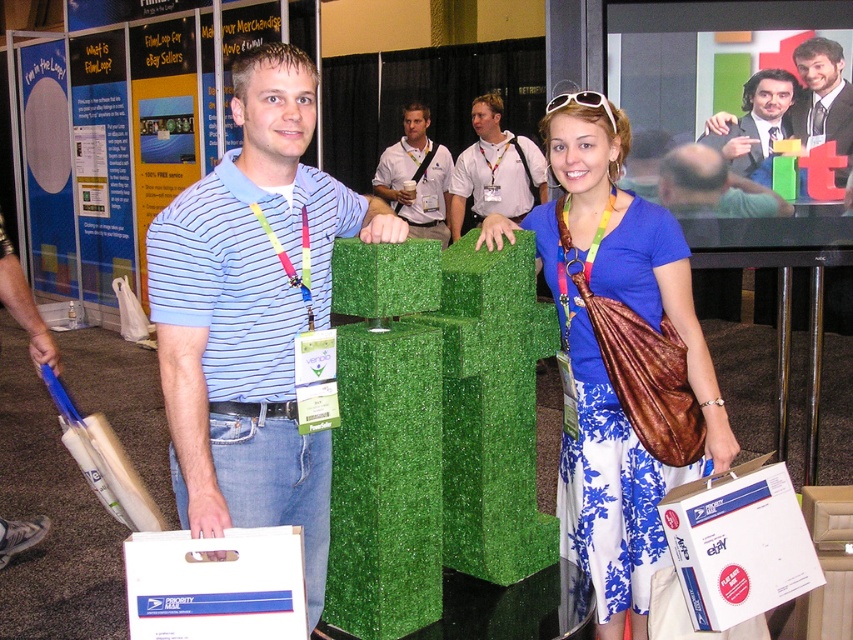
Does light blue striped shirt at center lie in front of smooth black suit at upper right?

No, light blue striped shirt at center is further to the viewer.

What are the coordinates of `light blue striped shirt at center` in the screenshot? It's located at (495, 170).

Is white matte box at lower right bigger than smooth suit at upper right?

Correct, white matte box at lower right is larger in size than smooth suit at upper right.

Consider the image. Does white matte box at lower right have a lesser width compared to smooth suit at upper right?

No, white matte box at lower right is not thinner than smooth suit at upper right.

Identify the location of white matte box at lower right. (737, 545).

Is point (596, 563) closer to camera compared to point (252, 612)?

No, it is not.

Is blue satin dress at center shorter than white matte plastic bag at lower center?

Incorrect, blue satin dress at center's height does not fall short of white matte plastic bag at lower center's.

Describe the element at coordinates (602, 358) in the screenshot. This screenshot has width=853, height=640. I see `blue satin dress at center` at that location.

What are the coordinates of `blue satin dress at center` in the screenshot? It's located at (602, 358).